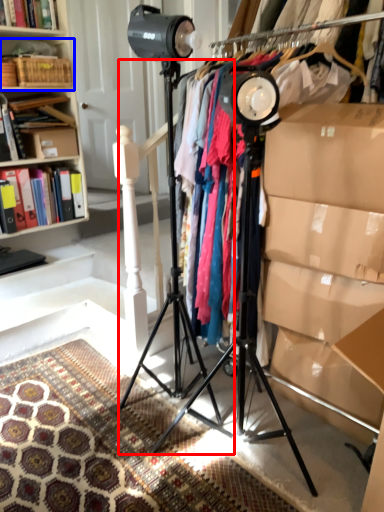
Question: Which object is closer to the camera taking this photo, tripod (highlighted by a red box) or shelf (highlighted by a blue box)?

Choices:
 (A) tripod
 (B) shelf

Answer: (A)